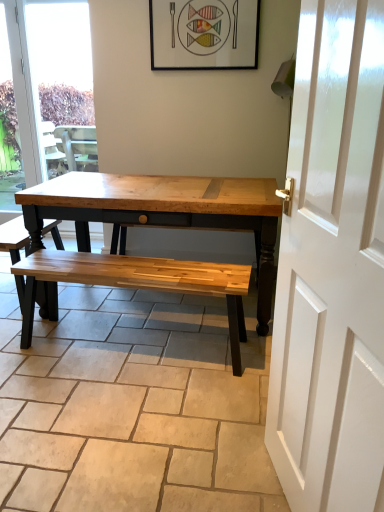
Question: Considering the relative sizes of natural wood bench at center and wooden bench at center in the image provided, is natural wood bench at center wider than wooden bench at center?

Choices:
 (A) no
 (B) yes

Answer: (B)

Question: Is natural wood bench at center taller than wooden bench at center?

Choices:
 (A) yes
 (B) no

Answer: (B)

Question: From the image's perspective, is natural wood bench at center under wooden bench at center?

Choices:
 (A) yes
 (B) no

Answer: (A)

Question: Does natural wood bench at center have a lesser width compared to wooden bench at center?

Choices:
 (A) no
 (B) yes

Answer: (A)

Question: From a real-world perspective, is natural wood bench at center physically above wooden bench at center?

Choices:
 (A) no
 (B) yes

Answer: (A)

Question: From a real-world perspective, is matte black picture frame at upper center physically located above or below wooden bench at center?

Choices:
 (A) below
 (B) above

Answer: (B)

Question: Is point (205, 44) positioned closer to the camera than point (0, 224)?

Choices:
 (A) farther
 (B) closer

Answer: (B)

Question: Is matte black picture frame at upper center taller or shorter than wooden bench at center?

Choices:
 (A) tall
 (B) short

Answer: (B)

Question: Which is correct: matte black picture frame at upper center is inside wooden bench at center, or outside of it?

Choices:
 (A) inside
 (B) outside

Answer: (B)

Question: Considering the positions of natural wood bench at center and wooden bench at center in the image, is natural wood bench at center taller or shorter than wooden bench at center?

Choices:
 (A) short
 (B) tall

Answer: (A)

Question: Is natural wood bench at center to the left or to the right of wooden bench at center in the image?

Choices:
 (A) left
 (B) right

Answer: (B)

Question: Is natural wood bench at center inside or outside of wooden bench at center?

Choices:
 (A) outside
 (B) inside

Answer: (A)

Question: From a real-world perspective, is natural wood bench at center physically located above or below wooden bench at center?

Choices:
 (A) above
 (B) below

Answer: (B)

Question: Is point (233, 49) positioned closer to the camera than point (39, 65)?

Choices:
 (A) closer
 (B) farther

Answer: (A)

Question: From a real-world perspective, is matte black picture frame at upper center positioned above or below transparent glass window at upper left?

Choices:
 (A) below
 (B) above

Answer: (B)